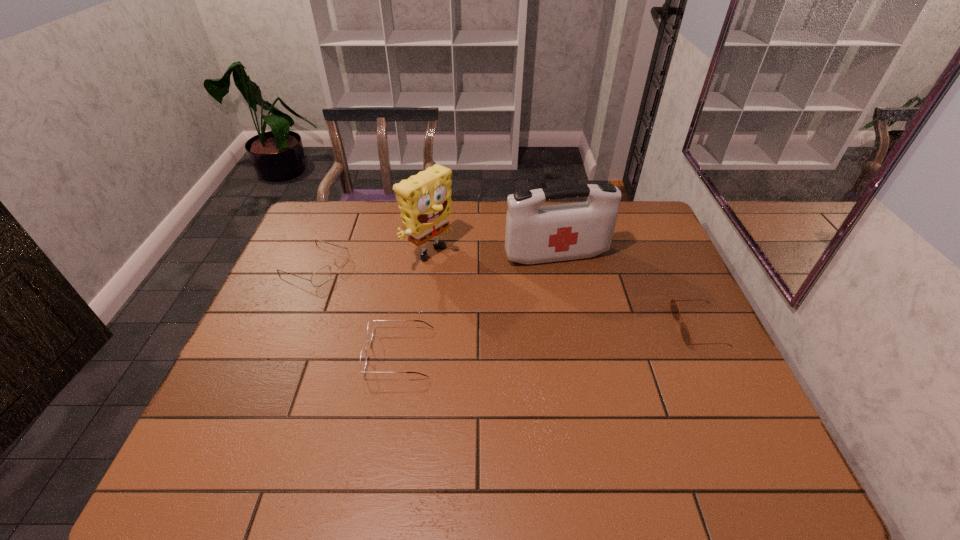
Locate an element on the screen. The image size is (960, 540). free spot between the sponge and the rightmost object is located at coordinates (564, 291).

Identify the location of vacant area that lies between the sunglasses and the sponge. (564, 291).

Locate an element on the screen. This screenshot has height=540, width=960. unoccupied area between the sunglasses and the sponge is located at coordinates (564, 291).

You are a GUI agent. You are given a task and a screenshot of the screen. Output one action in this format:
    pyautogui.click(x=<x>, y=<y>)
    Task: Click on the empty location between the left spectacles and the sunglasses
    Image resolution: width=960 pixels, height=540 pixels.
    Given the screenshot: What is the action you would take?
    click(507, 296)

Find the location of `free spot between the sponge and the first-aid kit`. free spot between the sponge and the first-aid kit is located at coordinates (492, 255).

The image size is (960, 540). I want to click on vacant space in between the farther spectacles and the nearer spectacles, so click(357, 309).

The image size is (960, 540). Find the location of `vacant space in between the left spectacles and the first-aid kit`. vacant space in between the left spectacles and the first-aid kit is located at coordinates (436, 260).

The image size is (960, 540). What are the coordinates of `unoccupied area between the left spectacles and the second object from right to left` in the screenshot? It's located at (436, 260).

Locate an element on the screen. vacant space that is in between the first-aid kit and the shortest object is located at coordinates (627, 291).

Find the location of a particular element. The width and height of the screenshot is (960, 540). vacant region between the fourth object from left to right and the nearer spectacles is located at coordinates (478, 304).